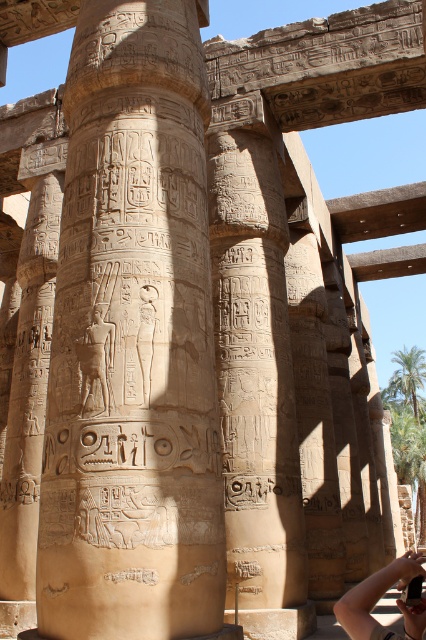
You are an archaeologist examining the temple structure. You notice two points marked on the temple wall. The first point is located at coordinates point (97, 273), and the second is at point (353, 602). Which point is closer to you as you stand in front of the temple?

Point (97, 273) is closer to you than point (353, 602) because it is further to the viewer.

You are an archaeologist examining the temple structure. You notice two columns at the center of the scene. Which one is positioned higher up in the image, the beige stone column at center or the carved stone column at center?

The beige stone column at center is located above the carved stone column at center, so it is positioned higher up in the image.